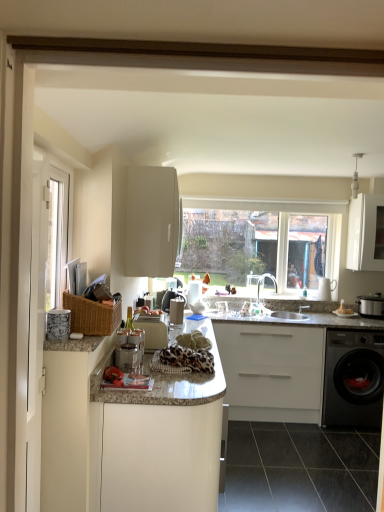
Identify the location of white plastic toaster at center, positioned as the third appliance in front-to-back order. This screenshot has height=512, width=384. (153, 329).

What is the approximate width of white matte cabinet at upper center, which is the 1th cabinetry in left-to-right order?

The width of white matte cabinet at upper center, which is the 1th cabinetry in left-to-right order, is 14.35 inches.

Measure the distance between metallic silver slow cooker at right, the 1th appliance viewed from the right, and camera.

The depth of metallic silver slow cooker at right, the 1th appliance viewed from the right, is 3.74 meters.

Image resolution: width=384 pixels, height=512 pixels. What are the coordinates of `white glossy screen door at left` in the screenshot? It's located at (43, 297).

Describe the element at coordinates (353, 378) in the screenshot. I see `black glossy washing machine at lower right` at that location.

I want to click on white plastic toaster at center, positioned as the second appliance in back-to-front order, so click(153, 329).

Is white plastic toaster at center, positioned as the third appliance in front-to-back order, touching white painted wood window frame at left?

No.

Is white plastic toaster at center, the third appliance when ordered from left to right, spatially inside white painted wood window frame at left, or outside of it?

The correct answer is: outside.

What's the angular difference between white plastic toaster at center, positioned as the third appliance in front-to-back order, and white painted wood window frame at left's facing directions?

The angular difference between white plastic toaster at center, positioned as the third appliance in front-to-back order, and white painted wood window frame at left is 0.228 degrees.

Is the depth of metallic can at center, the second appliance viewed from the front, less than that of white glossy screen door at left?

No, the depth of metallic can at center, the second appliance viewed from the front, is greater than that of white glossy screen door at left.

Is metallic can at center, marked as the second appliance in a left-to-right arrangement, positioned far away from white glossy screen door at left?

That's not correct — metallic can at center, marked as the second appliance in a left-to-right arrangement, is a little close to white glossy screen door at left.

What's the angular difference between metallic can at center, the 3th appliance viewed from the right, and white glossy screen door at left's facing directions?

0.228 degrees.

Do you think metallic can at center, which is counted as the 3th appliance, starting from the back, is within white glossy screen door at left, or outside of it?

metallic can at center, which is counted as the 3th appliance, starting from the back, exists outside the volume of white glossy screen door at left.

How far apart are white glossy screen door at left and white glossy countertop at center, arranged as the third cabinetry when viewed from the right?

The distance of white glossy screen door at left from white glossy countertop at center, arranged as the third cabinetry when viewed from the right, is 17.91 inches.

Consider the image. Which is more to the right, white glossy screen door at left or white glossy countertop at center, arranged as the third cabinetry when viewed from the right?

From the viewer's perspective, white glossy countertop at center, arranged as the third cabinetry when viewed from the right, appears more on the right side.

Is there a large distance between white glossy screen door at left and white glossy countertop at center, the 2th cabinetry positioned from the left?

white glossy screen door at left is actually quite close to white glossy countertop at center, the 2th cabinetry positioned from the left.

Is white glossy screen door at left inside the boundaries of white glossy countertop at center, the 2th cabinetry positioned from the left, or outside?

white glossy screen door at left cannot be found inside white glossy countertop at center, the 2th cabinetry positioned from the left.

Who is smaller, white matte cabinet at upper center, arranged as the 4th cabinetry when viewed from the right, or white glossy screen door at left?

With smaller size is white glossy screen door at left.

Measure the distance from white matte cabinet at upper center, arranged as the 4th cabinetry when viewed from the right, to white glossy screen door at left.

white matte cabinet at upper center, arranged as the 4th cabinetry when viewed from the right, and white glossy screen door at left are 85.45 centimeters apart.

Is white glossy screen door at left located within white matte cabinet at upper center, arranged as the 4th cabinetry when viewed from the right?

No, white glossy screen door at left is not inside white matte cabinet at upper center, arranged as the 4th cabinetry when viewed from the right.

Find the location of a particular element. Image resolution: width=384 pixels, height=512 pixels. the 1st cabinetry to the right of the white glossy screen door at left, starting your count from the anchor is located at coordinates (152, 221).

Is black glossy washing machine at lower right looking in the opposite direction of metallic can at center, the 3th appliance viewed from the right?

No.

Based on their sizes in the image, would you say black glossy washing machine at lower right is bigger or smaller than metallic can at center, the 3th appliance viewed from the right?

In the image, black glossy washing machine at lower right appears to be larger than metallic can at center, the 3th appliance viewed from the right.

Is black glossy washing machine at lower right taller than metallic can at center, marked as the second appliance in a left-to-right arrangement?

Yes.

Considering the relative sizes of black glossy washing machine at lower right and metallic can at center, which is counted as the 3th appliance, starting from the back, in the image provided, is black glossy washing machine at lower right wider than metallic can at center, which is counted as the 3th appliance, starting from the back,?

Yes, black glossy washing machine at lower right is wider than metallic can at center, which is counted as the 3th appliance, starting from the back.

From a real-world perspective, is metallic can at center, the 3th appliance viewed from the right, physically above satin nickel faucet at center?

Incorrect, from a real-world perspective, metallic can at center, the 3th appliance viewed from the right, is lower than satin nickel faucet at center.

Is satin nickel faucet at center located within metallic can at center, the 3th appliance viewed from the right?

No, satin nickel faucet at center is not inside metallic can at center, the 3th appliance viewed from the right.

The image size is (384, 512). What are the coordinates of `tap behind the metallic can at center, the second appliance viewed from the front` in the screenshot? It's located at (263, 283).

Who is more distant, metallic can at center, the second appliance viewed from the front, or satin nickel faucet at center?

satin nickel faucet at center is behind.

The image size is (384, 512). I want to click on the 1st cabinetry behind when counting from the metallic can at center, the 3th appliance viewed from the right, so click(x=152, y=221).

How different are the orientations of metallic can at center, the second appliance viewed from the front, and white matte cabinet at upper center, arranged as the 4th cabinetry when viewed from the right, in degrees?

The angular difference between metallic can at center, the second appliance viewed from the front, and white matte cabinet at upper center, arranged as the 4th cabinetry when viewed from the right, is 0.000104 degrees.

Which is more to the right, metallic can at center, marked as the second appliance in a left-to-right arrangement, or white matte cabinet at upper center, arranged as the 4th cabinetry when viewed from the right?

From the viewer's perspective, white matte cabinet at upper center, arranged as the 4th cabinetry when viewed from the right, appears more on the right side.

From a real-world perspective, does metallic can at center, the second appliance viewed from the front, stand above white matte cabinet at upper center, arranged as the 4th cabinetry when viewed from the right?

No, from a real-world perspective, metallic can at center, the second appliance viewed from the front, is not above white matte cabinet at upper center, arranged as the 4th cabinetry when viewed from the right.

You are a GUI agent. You are given a task and a screenshot of the screen. Output one action in this format:
    pyautogui.click(x=<x>, y=<y>)
    Task: Click on the 2nd appliance behind the white painted wood window frame at left
    The height and width of the screenshot is (512, 384).
    Given the screenshot: What is the action you would take?
    pyautogui.click(x=153, y=329)

This screenshot has width=384, height=512. Find the location of `screen door in front of the metallic can at center, which is counted as the 3th appliance, starting from the back`. screen door in front of the metallic can at center, which is counted as the 3th appliance, starting from the back is located at coordinates (43, 297).

Consider the image. Considering their positions, is white plastic toaster at center, the third appliance when ordered from left to right, positioned further to satin nickel faucet at center than white glossy screen door at left?

white glossy screen door at left is positioned further to the anchor satin nickel faucet at center.

Looking at this image, from the image, which object appears to be farther from white matte cabinet at upper right, the first cabinetry in the right-to-left sequence, white matte cabinet at upper center, which is the 1th cabinetry in left-to-right order, or white glossy screen door at left?

Based on the image, white glossy screen door at left appears to be further to white matte cabinet at upper right, the first cabinetry in the right-to-left sequence.

Based on their spatial positions, is white plastic toaster at center, positioned as the third appliance in front-to-back order, or white matte cabinet at upper center, arranged as the 4th cabinetry when viewed from the right, further from white painted wood window frame at left?

white matte cabinet at upper center, arranged as the 4th cabinetry when viewed from the right, lies further to white painted wood window frame at left than the other object.

Based on their spatial positions, is metallic silver slow cooker at right, positioned as the first appliance in back-to-front order, or matte white bowl at right closer to white plastic toaster at center, positioned as the third appliance in front-to-back order?

metallic silver slow cooker at right, positioned as the first appliance in back-to-front order.

When comparing their distances from metallic can at center, the 3th appliance viewed from the right, does white plastic toaster at center, positioned as the second appliance in right-to-left order, or metallic silver slow cooker at right, the 1th appliance viewed from the right, seem closer?

white plastic toaster at center, positioned as the second appliance in right-to-left order, lies closer to metallic can at center, the 3th appliance viewed from the right, than the other object.

Which object lies nearer to the anchor point white plastic toaster at center, positioned as the second appliance in back-to-front order, white glossy countertop at center, the 2th cabinetry positioned from the left, or white painted wood window frame at left?

white glossy countertop at center, the 2th cabinetry positioned from the left, lies closer to white plastic toaster at center, positioned as the second appliance in back-to-front order, than the other object.

From the picture: When comparing their distances from black glossy washing machine at lower right, does white matte cabinet at upper right, the first cabinetry in the right-to-left sequence, or satin nickel faucet at center seem closer?

Among the two, white matte cabinet at upper right, the first cabinetry in the right-to-left sequence, is located nearer to black glossy washing machine at lower right.

From the picture: From the image, which object appears to be farther from porcelain textured mug at left, the 4th appliance from the right, matte white bowl at right or white plastic toaster at center, the third appliance when ordered from left to right?

Based on the image, matte white bowl at right appears to be further to porcelain textured mug at left, the 4th appliance from the right.

This screenshot has width=384, height=512. What are the coordinates of `cabinetry between white glossy screen door at left and metallic can at center, the 3th appliance viewed from the right, along the z-axis` in the screenshot? It's located at (124, 439).

You are a GUI agent. You are given a task and a screenshot of the screen. Output one action in this format:
    pyautogui.click(x=<x>, y=<y>)
    Task: Click on the tap located between white plastic toaster at center, positioned as the second appliance in back-to-front order, and matte white bowl at right in the left-right direction
    
    Given the screenshot: What is the action you would take?
    pyautogui.click(x=263, y=283)

Where is `tap between white matte cabinet at center, which appears as the second cabinetry when viewed from the right, and metallic silver slow cooker at right, marked as the 4th appliance in a front-to-back arrangement, in the horizontal direction`? tap between white matte cabinet at center, which appears as the second cabinetry when viewed from the right, and metallic silver slow cooker at right, marked as the 4th appliance in a front-to-back arrangement, in the horizontal direction is located at coordinates (263, 283).

This screenshot has width=384, height=512. What are the coordinates of `washing machine located between white matte cabinet at upper center, which is the 1th cabinetry in left-to-right order, and matte white bowl at right in the left-right direction` in the screenshot? It's located at (353, 378).